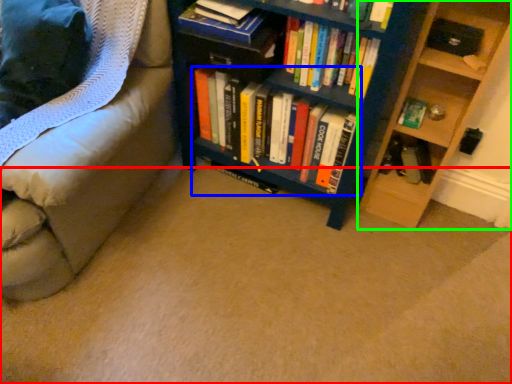
Question: Based on their relative distances, which object is farther from plain (highlighted by a red box)? Choose from book (highlighted by a blue box) and shelf (highlighted by a green box).

Choices:
 (A) book
 (B) shelf

Answer: (B)